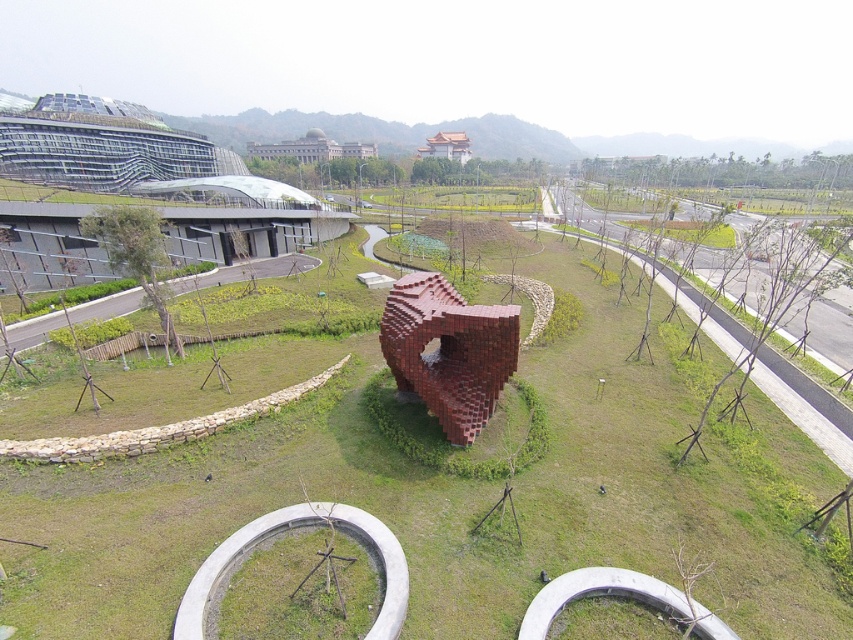
This screenshot has width=853, height=640. Describe the element at coordinates (424, 499) in the screenshot. I see `green grassy at center` at that location.

In order to click on green grassy at center in this screenshot , I will do `click(424, 499)`.